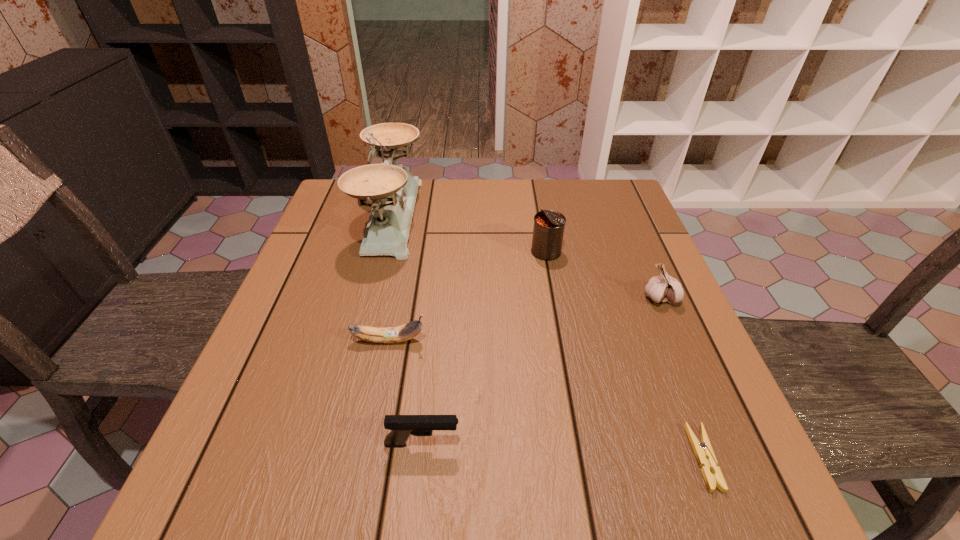
The width and height of the screenshot is (960, 540). What are the coordinates of `vacant space located 0.050m at the stem of the banana` in the screenshot? It's located at (451, 340).

This screenshot has width=960, height=540. I want to click on free space located on the front-facing side of the pistol, so click(x=568, y=444).

Where is `vacant point located 0.050m on the back of the shortest object`? vacant point located 0.050m on the back of the shortest object is located at coordinates (682, 401).

Find the location of a particular element. Image resolution: width=960 pixels, height=540 pixels. object that is positioned at the far edge is located at coordinates (393, 190).

You are a GUI agent. You are given a task and a screenshot of the screen. Output one action in this format:
    pyautogui.click(x=<x>, y=<y>)
    Task: Click on the object present at the near edge
    The width and height of the screenshot is (960, 540).
    Given the screenshot: What is the action you would take?
    pyautogui.click(x=703, y=451)

Where is `object located at the left edge`? object located at the left edge is located at coordinates (393, 190).

You are a GUI agent. You are given a task and a screenshot of the screen. Output one action in this format:
    pyautogui.click(x=<x>, y=<y>)
    Task: Click on the garlic located in the right edge section of the desktop
    
    Given the screenshot: What is the action you would take?
    pyautogui.click(x=664, y=288)

Where is `clothespin present at the right edge`? clothespin present at the right edge is located at coordinates (703, 451).

You are a GUI agent. You are given a task and a screenshot of the screen. Output one action in this format:
    pyautogui.click(x=<x>, y=<y>)
    Task: Click on the object that is at the far left corner
    The image size is (960, 540).
    Given the screenshot: What is the action you would take?
    pyautogui.click(x=393, y=190)

Find the location of a particular element. The image size is (960, 540). object located at the near right corner is located at coordinates (703, 451).